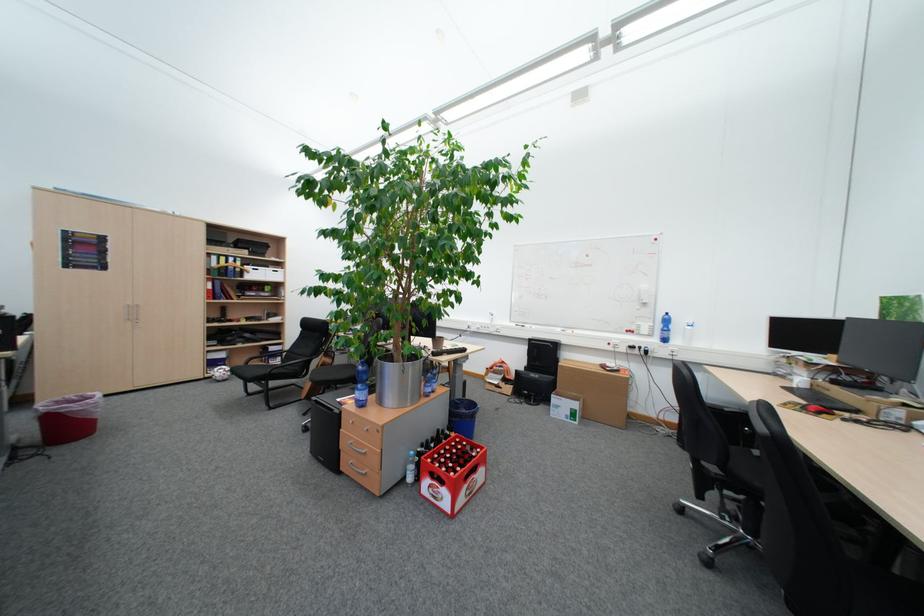
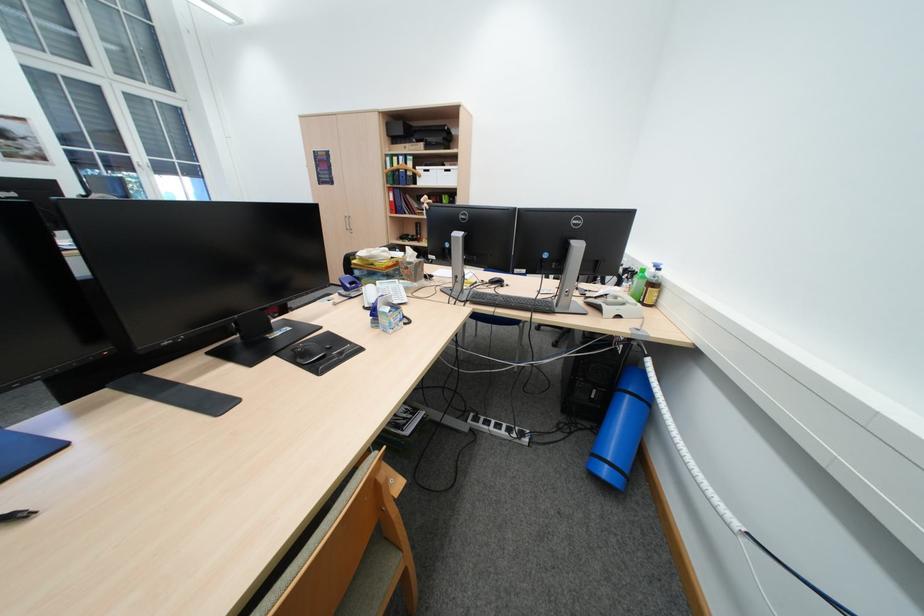
Where in the second image is the point corresponding to (x=271, y=276) from the first image?

(442, 179)